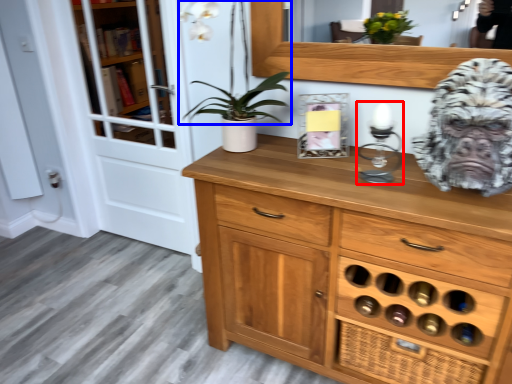
Question: Which object appears farthest to the camera in this image, candle holder (highlighted by a red box) or plant (highlighted by a blue box)?

Choices:
 (A) candle holder
 (B) plant

Answer: (B)